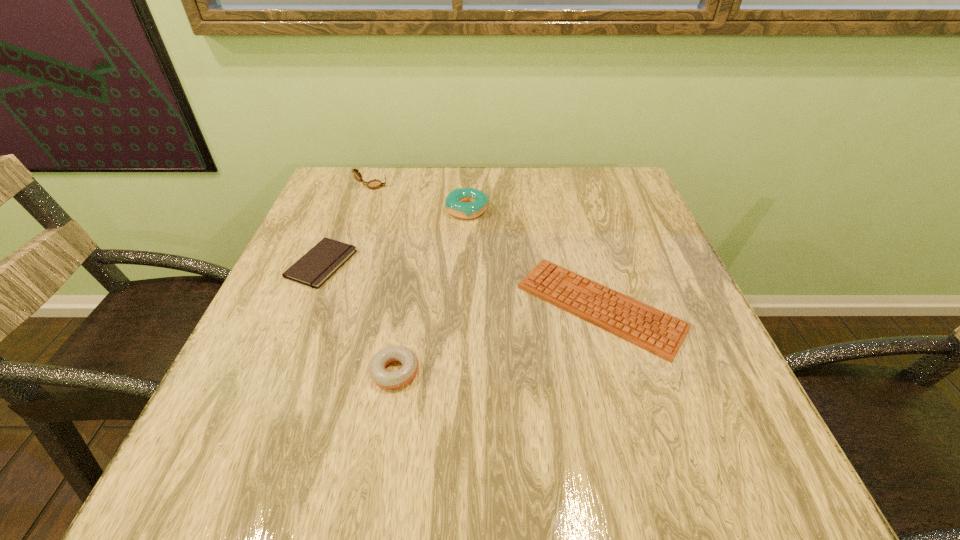
The height and width of the screenshot is (540, 960). Find the location of `the tallest object`. the tallest object is located at coordinates (375, 184).

The image size is (960, 540). What are the coordinates of `the farthest object` in the screenshot? It's located at (375, 184).

You are a GUI agent. You are given a task and a screenshot of the screen. Output one action in this format:
    pyautogui.click(x=<x>, y=<y>)
    Task: Click on the fourth nearest object
    This screenshot has height=540, width=960.
    Given the screenshot: What is the action you would take?
    pyautogui.click(x=466, y=203)

Identify the location of the fourth object from left to right. This screenshot has height=540, width=960. coord(466,203).

You are a GUI agent. You are given a task and a screenshot of the screen. Output one action in this format:
    pyautogui.click(x=<x>, y=<y>)
    Task: Click on the shorter doughnut
    The image size is (960, 540).
    Given the screenshot: What is the action you would take?
    pyautogui.click(x=377, y=369)

Image resolution: width=960 pixels, height=540 pixels. Identify the location of the third tallest object. (377, 369).

At what (x,y) coordinates should I click in order to perform the action: click on computer keyboard. Please return your answer as a coordinate pair (x, y). The height and width of the screenshot is (540, 960). Looking at the image, I should click on (662, 334).

Locate an element on the screen. The width and height of the screenshot is (960, 540). checkbook is located at coordinates (313, 269).

Locate an element on the screen. The height and width of the screenshot is (540, 960). vacant space situated on the face of the tallest object is located at coordinates (506, 186).

Find the location of `vacant point located on the left of the second farthest object`. vacant point located on the left of the second farthest object is located at coordinates (332, 210).